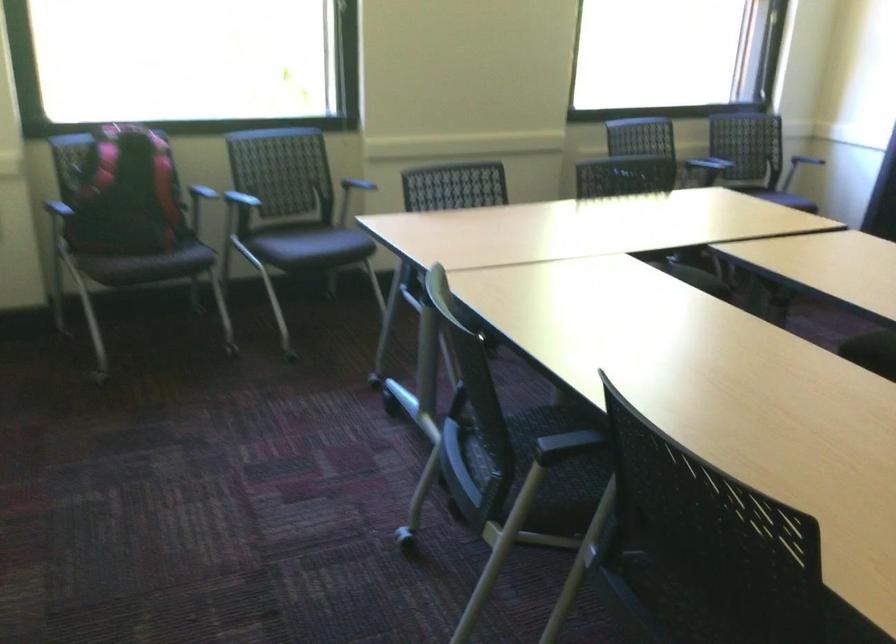
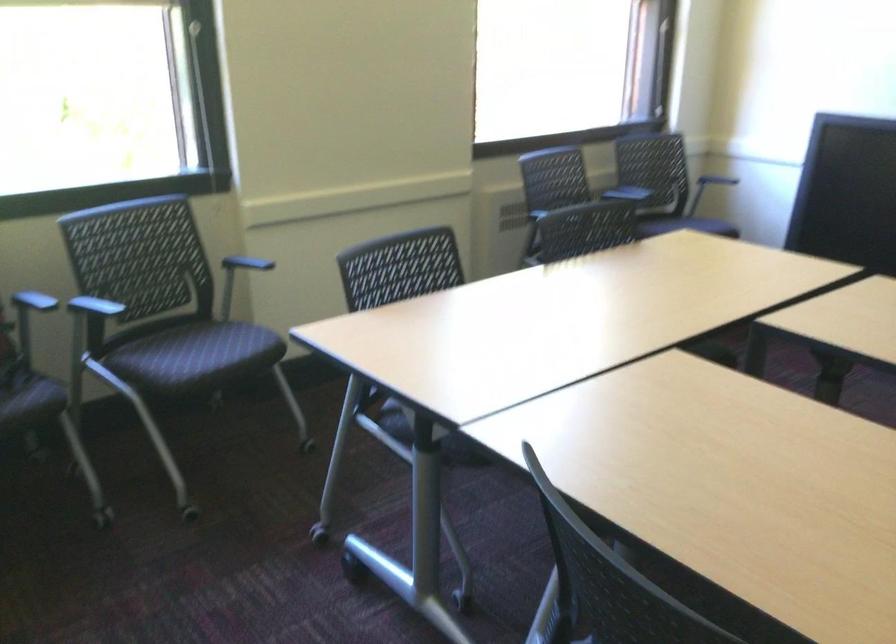
What movement of the cameraman would produce the second image?

The movement direction of the cameraman is left, forward.